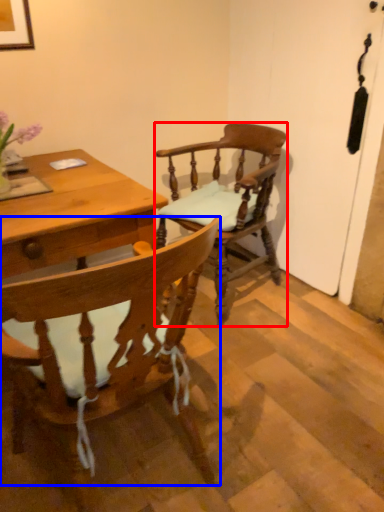
Question: Which point is further to the camera, chair (highlighted by a red box) or chair (highlighted by a blue box)?

Choices:
 (A) chair
 (B) chair

Answer: (A)